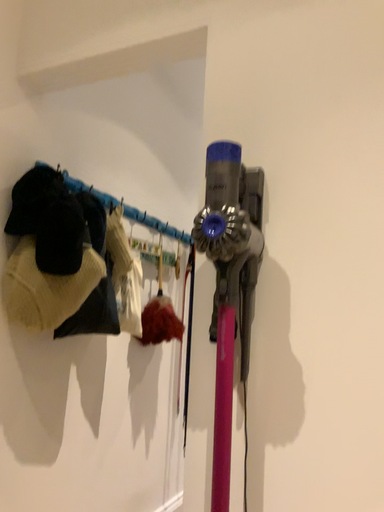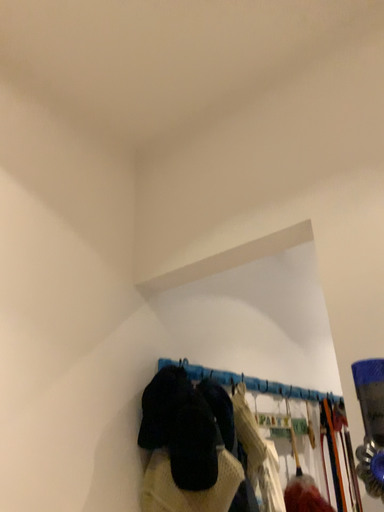
Question: Which way did the camera rotate in the video?

Choices:
 (A) rotated downward
 (B) rotated upward

Answer: (B)